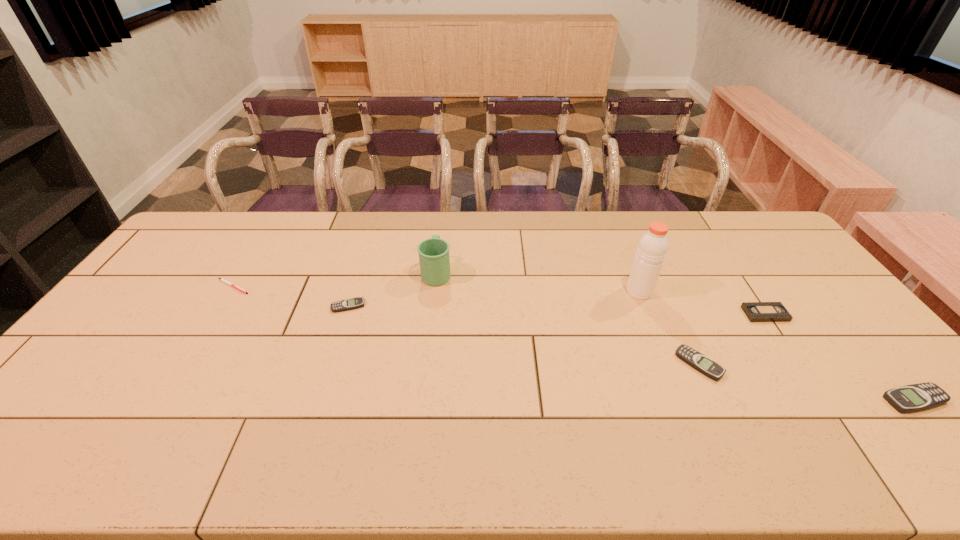
You are a GUI agent. You are given a task and a screenshot of the screen. Output one action in this format:
    pyautogui.click(x=<x>, y=<y>)
    Task: Click on the second object from left to right
    The width and height of the screenshot is (960, 540).
    Given the screenshot: What is the action you would take?
    pyautogui.click(x=357, y=302)

Where is `the farthest beeper`? Image resolution: width=960 pixels, height=540 pixels. the farthest beeper is located at coordinates (357, 302).

This screenshot has height=540, width=960. Find the location of `the second farthest beeper`. the second farthest beeper is located at coordinates (703, 364).

In order to click on the sixth farthest object in this screenshot , I will do `click(703, 364)`.

This screenshot has height=540, width=960. I want to click on the rightmost object, so click(x=916, y=397).

I want to click on the tallest beeper, so [916, 397].

Identify the location of the shortest object. (225, 281).

In order to click on the leftmost object in this screenshot , I will do `click(225, 281)`.

What are the coordinates of `mug` in the screenshot? It's located at (434, 259).

Identify the location of the fifth object from right to left. (434, 259).